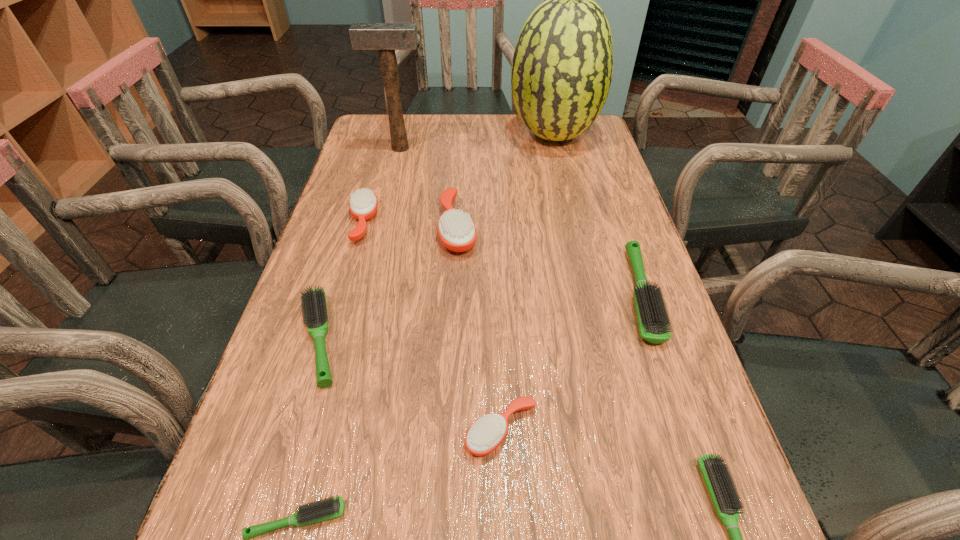
At what (x,y) coordinates should I click in order to perform the action: click on orange hairbrush that stands as the third closest to the third smallest light hairbrush. Please return your answer as a coordinate pair (x, y). Looking at the image, I should click on (487, 433).

Identify the location of light hairbrush object that ranks as the closest to the second smallest orange hairbrush. (313, 300).

Choose which light hairbrush is the second nearest neighbor to the third smallest light hairbrush. Please provide its 2D coordinates. Your answer should be formatted as a tuple, i.e. [(x, y)], where the tuple contains the x and y coordinates of a point satisfying the conditions above.

[(652, 318)]

Image resolution: width=960 pixels, height=540 pixels. What are the coordinates of `vacant region that satisfies the following two spatial constraints: 1. on the front side of the leftmost orange hairbrush; 2. on the right side of the biggest light hairbrush` in the screenshot? It's located at (342, 294).